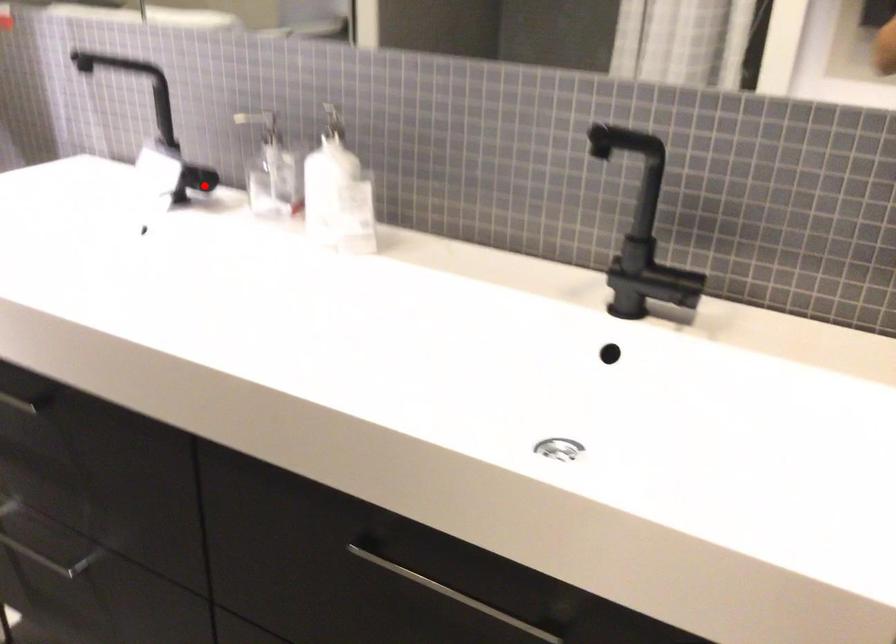
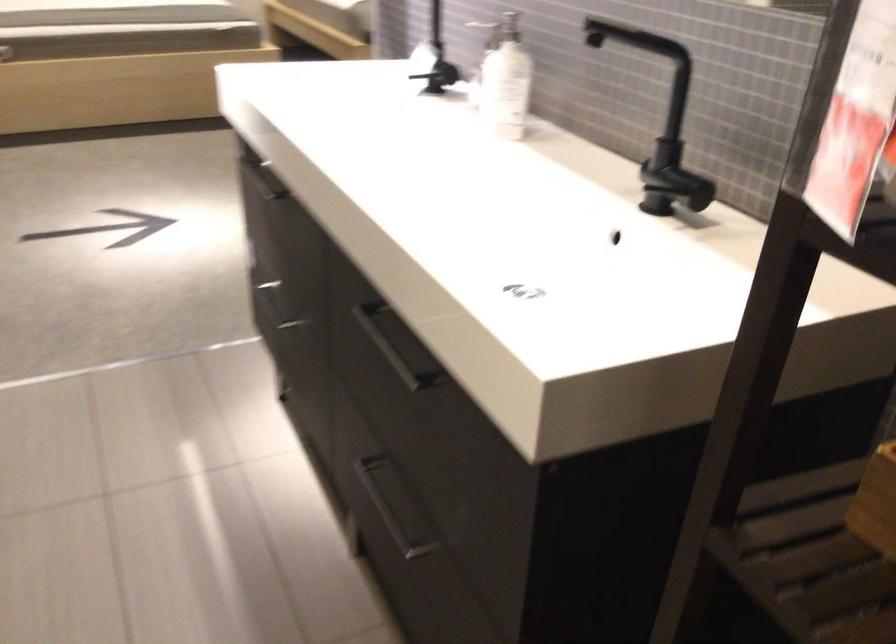
Where in the second image is the point corresponding to the highlighted location from the first image?

(440, 77)